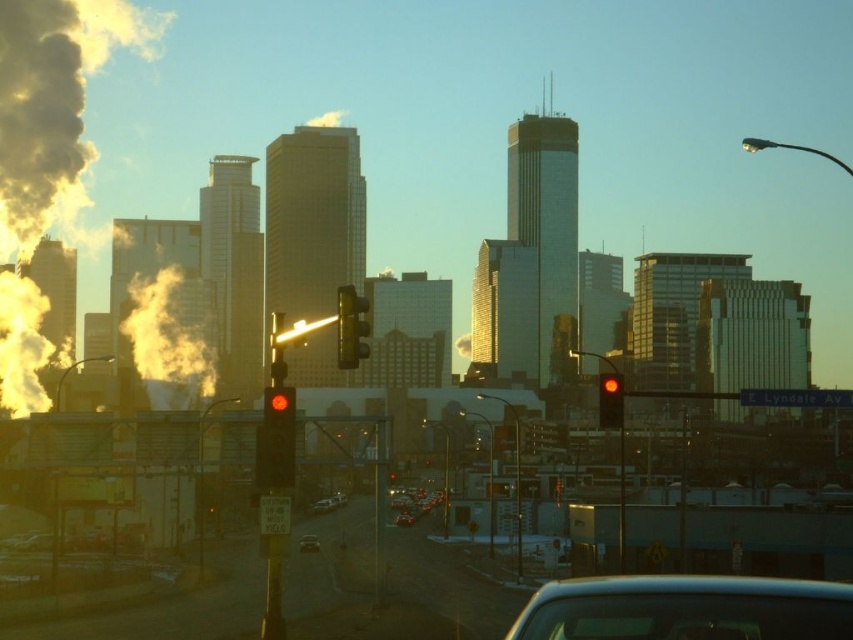
Question: Which object is farther from the camera taking this photo?

Choices:
 (A) red glass traffic light at center
 (B) yellowish foggy smoke at left

Answer: (B)

Question: Can you confirm if yellowish foggy smoke at left is positioned to the right of yellow reflective traffic light at center?

Choices:
 (A) yes
 (B) no

Answer: (B)

Question: Can you confirm if yellowish foggy smoke at left is positioned to the left of metallic silver car at center?

Choices:
 (A) no
 (B) yes

Answer: (B)

Question: Considering the real-world distances, which object is farthest from the yellowish foggy smoke at left?

Choices:
 (A) red glass traffic light at center
 (B) metallic silver car at center

Answer: (A)

Question: Which of the following is the farthest from the observer?

Choices:
 (A) matte black traffic light at center-left
 (B) yellowish foggy smoke at left
 (C) yellow reflective traffic light at center

Answer: (B)

Question: Is metallic silver car at lower center wider than shiny silver car at center?

Choices:
 (A) no
 (B) yes

Answer: (B)